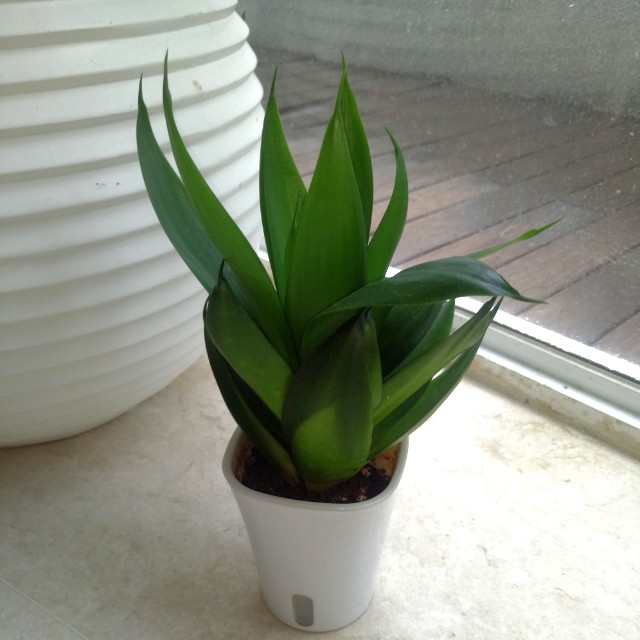
Image resolution: width=640 pixels, height=640 pixels. I want to click on glass window, so click(x=540, y=92).